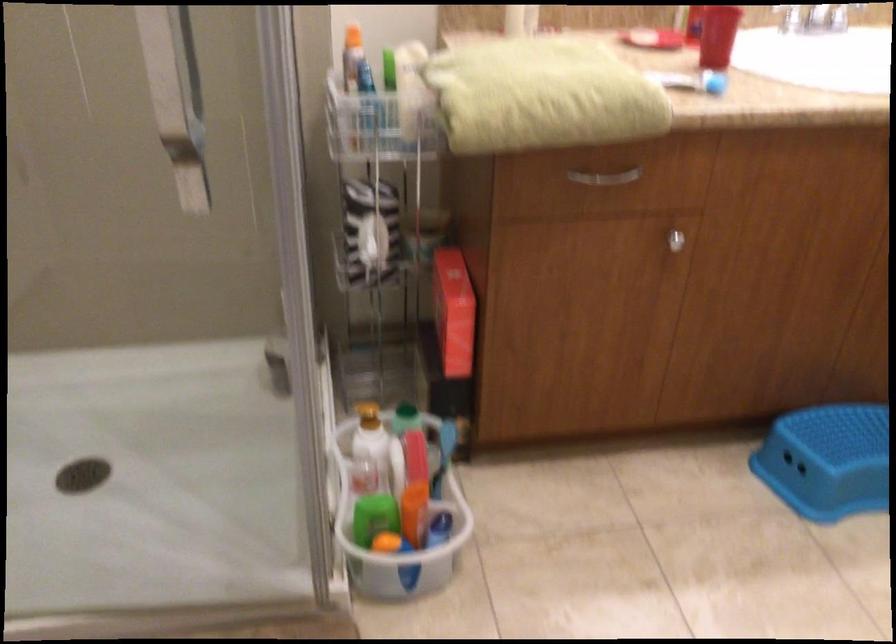
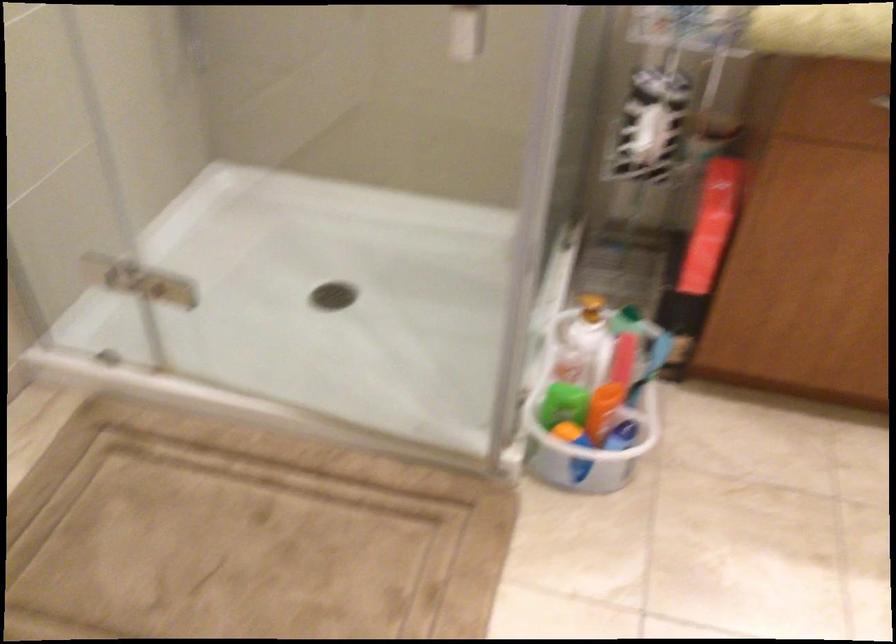
The point at (x=375, y=523) is marked in the first image. Where is the corresponding point in the second image?

(563, 402)